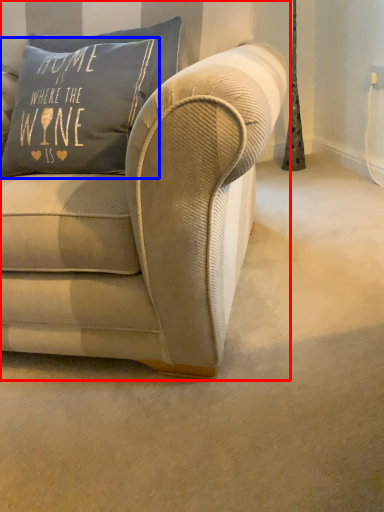
Question: Among these objects, which one is farthest to the camera, studio couch (highlighted by a red box) or pillow (highlighted by a blue box)?

Choices:
 (A) studio couch
 (B) pillow

Answer: (B)